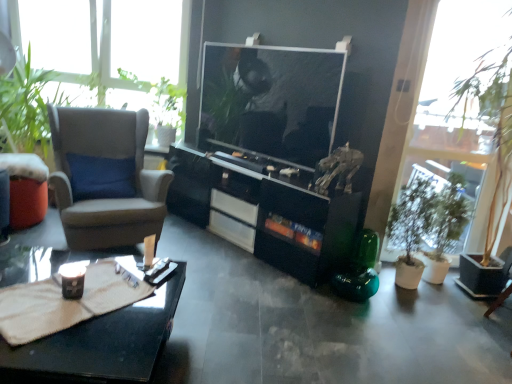
Question: Is gray fabric armchair at left to the left of matte orange table at left from the viewer's perspective?

Choices:
 (A) yes
 (B) no

Answer: (B)

Question: Is the depth of gray fabric armchair at left greater than that of matte orange table at left?

Choices:
 (A) no
 (B) yes

Answer: (A)

Question: Is matte orange table at left inside gray fabric armchair at left?

Choices:
 (A) no
 (B) yes

Answer: (A)

Question: From a real-world perspective, is gray fabric armchair at left over matte orange table at left?

Choices:
 (A) no
 (B) yes

Answer: (B)

Question: Does gray fabric armchair at left turn towards matte orange table at left?

Choices:
 (A) no
 (B) yes

Answer: (A)

Question: Does gray fabric armchair at left appear on the right side of matte orange table at left?

Choices:
 (A) no
 (B) yes

Answer: (B)

Question: Is black glossy cabinet at center behind gray fabric armchair at left?

Choices:
 (A) no
 (B) yes

Answer: (B)

Question: Are black glossy cabinet at center and gray fabric armchair at left making contact?

Choices:
 (A) no
 (B) yes

Answer: (A)

Question: Would you say black glossy cabinet at center contains gray fabric armchair at left?

Choices:
 (A) no
 (B) yes

Answer: (A)

Question: Considering the relative sizes of black glossy cabinet at center and gray fabric armchair at left in the image provided, is black glossy cabinet at center wider than gray fabric armchair at left?

Choices:
 (A) no
 (B) yes

Answer: (A)

Question: Can you confirm if black glossy cabinet at center is positioned to the left of gray fabric armchair at left?

Choices:
 (A) no
 (B) yes

Answer: (A)

Question: From a real-world perspective, is black glossy cabinet at center positioned under gray fabric armchair at left based on gravity?

Choices:
 (A) no
 (B) yes

Answer: (B)

Question: Is green matte plant at right inside green leafy plant at right?

Choices:
 (A) yes
 (B) no

Answer: (A)